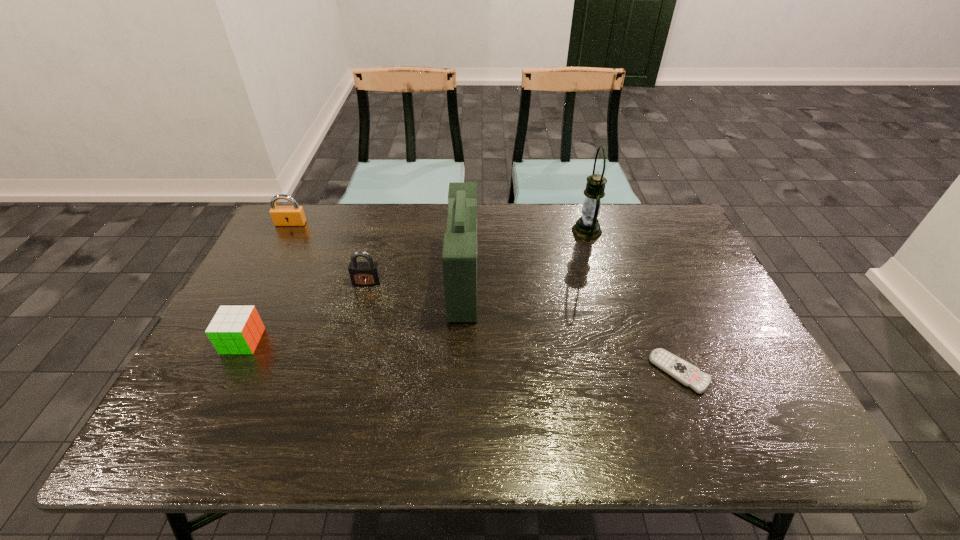
Where is `vacant point that satisfies the following two spatial constraints: 1. on the front-facing side of the first-aid kit; 2. on the front of the nearer padlock near the keyhole`? The width and height of the screenshot is (960, 540). vacant point that satisfies the following two spatial constraints: 1. on the front-facing side of the first-aid kit; 2. on the front of the nearer padlock near the keyhole is located at coordinates (464, 282).

In order to click on vacant region that satisfies the following two spatial constraints: 1. on the front-facing side of the third object from right to left; 2. on the right side of the rightmost object in this screenshot , I will do `click(460, 372)`.

Locate an element on the screen. Image resolution: width=960 pixels, height=540 pixels. vacant space that satisfies the following two spatial constraints: 1. to unlock the rightmost object from the front; 2. on the right side of the farther padlock is located at coordinates (212, 372).

The image size is (960, 540). What are the coordinates of `free space in the image that satisfies the following two spatial constraints: 1. on the side where the lantern emits light; 2. on the front side of the cube` in the screenshot? It's located at (619, 341).